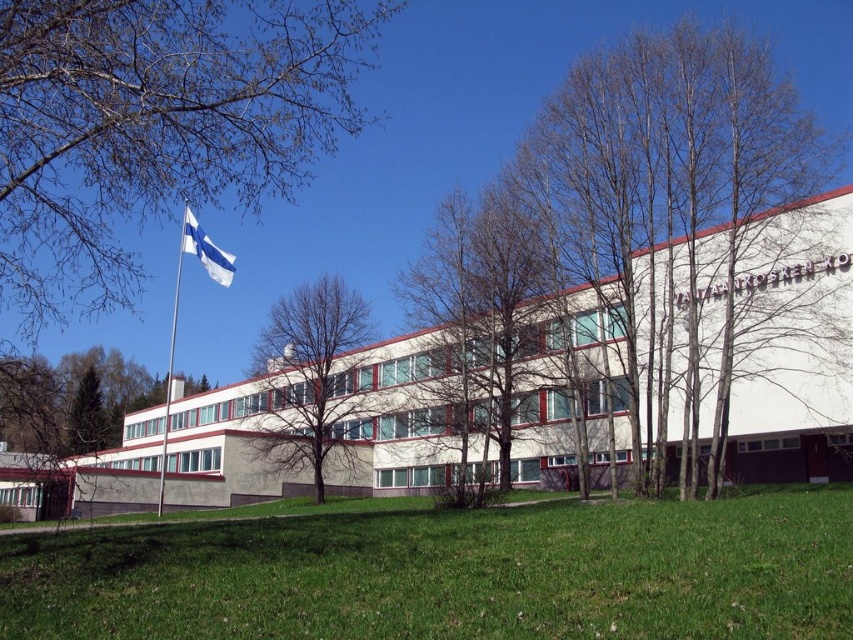
Question: Is green grass at lower center thinner than silver metallic flag pole at left?

Choices:
 (A) yes
 (B) no

Answer: (A)

Question: Among these points, which one is farthest from the camera?

Choices:
 (A) (212, 273)
 (B) (624, 104)

Answer: (A)

Question: Can you confirm if green grass at lower center is positioned above white fabric flag at upper left?

Choices:
 (A) no
 (B) yes

Answer: (A)

Question: Which point is closer to the camera taking this photo?

Choices:
 (A) (186, 243)
 (B) (618, 634)
 (C) (253, 372)

Answer: (B)

Question: Which of the following is the closest to the observer?

Choices:
 (A) (42, 140)
 (B) (340, 420)

Answer: (A)

Question: Can you confirm if bare brown tree at center is bigger than white fabric flag at upper left?

Choices:
 (A) yes
 (B) no

Answer: (A)